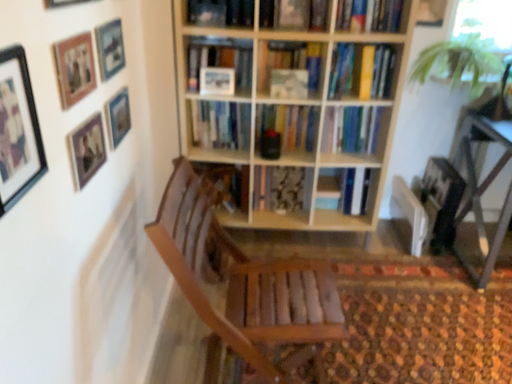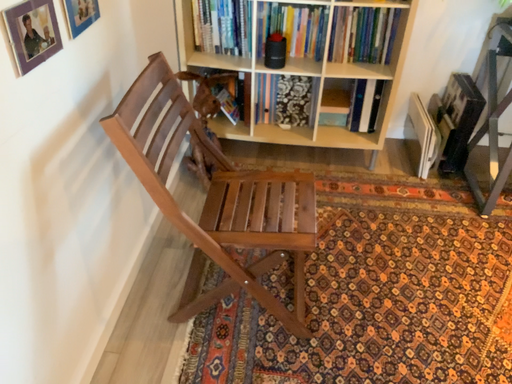
Question: Which way did the camera rotate in the video?

Choices:
 (A) rotated upward
 (B) rotated downward

Answer: (B)